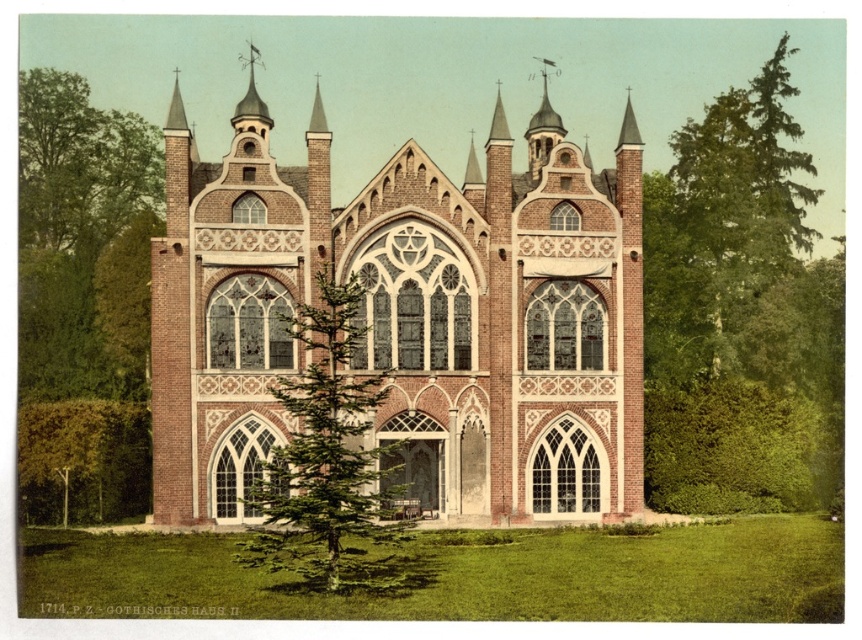
Is brick gothic church at center closer to the viewer compared to green leafy tree at right?

Yes, brick gothic church at center is in front of green leafy tree at right.

Is brick gothic church at center taller than green leafy tree at right?

Incorrect, brick gothic church at center's height is not larger of green leafy tree at right's.

Which is behind, point (489, 188) or point (698, 392)?

Point (698, 392)

You are a GUI agent. You are given a task and a screenshot of the screen. Output one action in this format:
    pyautogui.click(x=<x>, y=<y>)
    Task: Click on the brick gothic church at center
    The image size is (862, 640).
    Given the screenshot: What is the action you would take?
    pyautogui.click(x=409, y=314)

Between point (258, 406) and point (97, 432), which one is positioned behind?

Point (97, 432)

Does point (397, 176) come farther from viewer compared to point (55, 330)?

No, (397, 176) is in front of (55, 330).

Locate an element on the screen. brick gothic church at center is located at coordinates (409, 314).

Locate an element on the screen. The image size is (862, 640). brick gothic church at center is located at coordinates pyautogui.click(x=409, y=314).

Is the position of brick gothic church at center less distant than that of green leafy tree at center?

No, brick gothic church at center is behind green leafy tree at center.

Between point (617, 406) and point (360, 484), which one is positioned behind?

Positioned behind is point (617, 406).

The height and width of the screenshot is (640, 862). Find the location of `brick gothic church at center`. brick gothic church at center is located at coordinates (x=409, y=314).